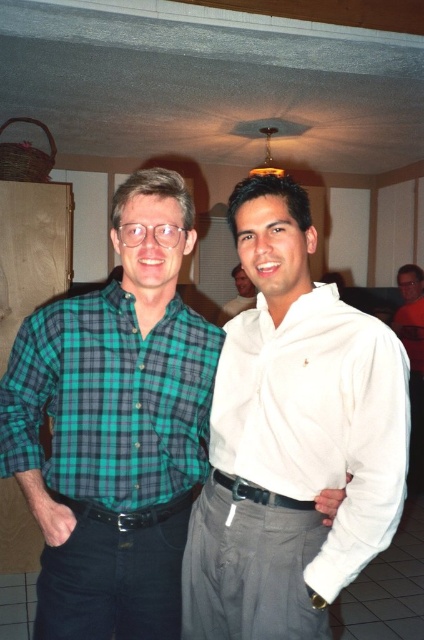
You are planning to hang a picture frame between the green plaid shirt at center and the green plaid shirt at left. Which shirt should the frame be placed closer to if you want it centered between them?

The green plaid shirt at center is positioned under the green plaid shirt at left, so to center the frame between them, it should be placed closer to the green plaid shirt at center since it is lower in position.